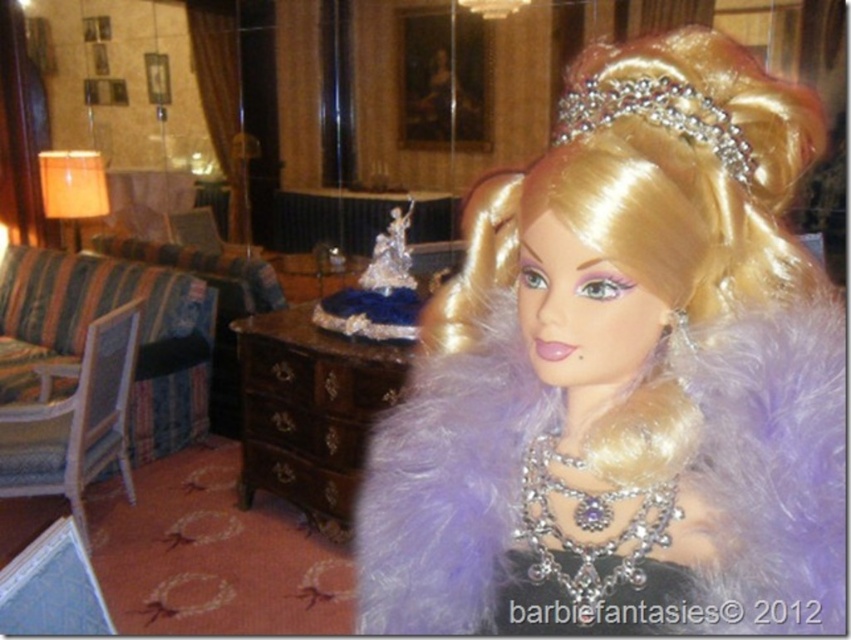
Question: Is silky blonde wig at upper center positioned in front of diamond encrusted tiara at upper center?

Choices:
 (A) yes
 (B) no

Answer: (A)

Question: Considering the real-world distances, which object is farthest from the silky blonde wig at upper center?

Choices:
 (A) diamond encrusted tiara at upper center
 (B) white wood armchair at left

Answer: (B)

Question: Which point appears farthest from the camera in this image?

Choices:
 (A) (78, 381)
 (B) (584, 90)

Answer: (A)

Question: Which point is closer to the camera?

Choices:
 (A) (705, 269)
 (B) (49, 456)

Answer: (A)

Question: Can you confirm if silky blonde wig at upper center is bigger than diamond encrusted tiara at upper center?

Choices:
 (A) yes
 (B) no

Answer: (A)

Question: Is silky blonde wig at upper center below diamond encrusted tiara at upper center?

Choices:
 (A) no
 (B) yes

Answer: (B)